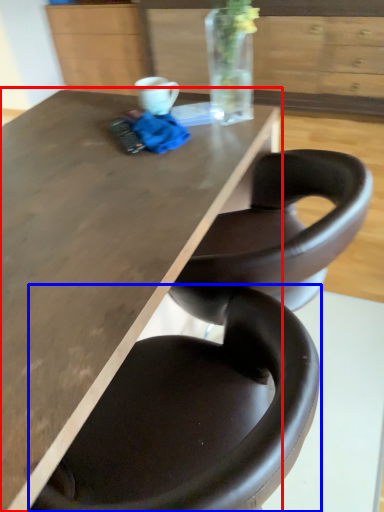
Question: Among these objects, which one is nearest to the camera, table (highlighted by a red box) or chair (highlighted by a blue box)?

Choices:
 (A) table
 (B) chair

Answer: (B)